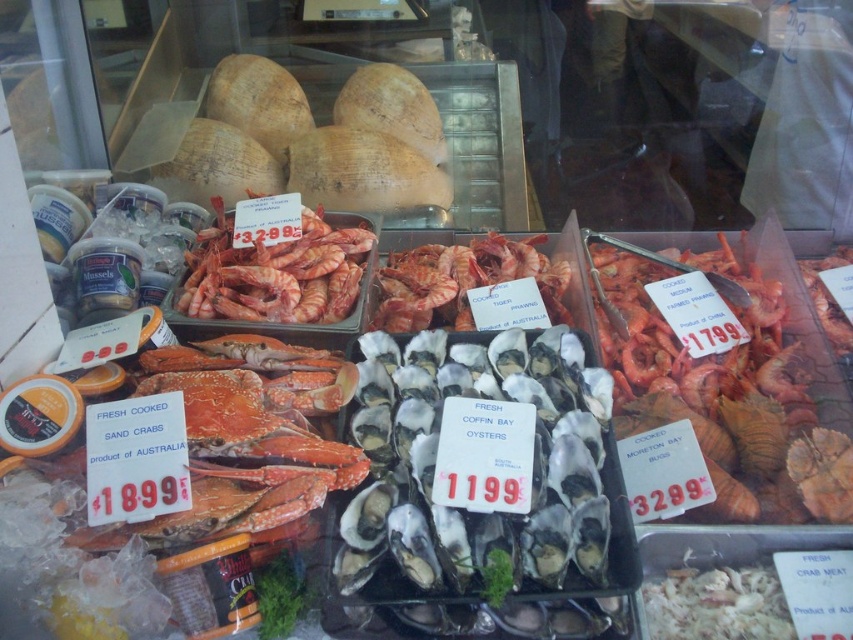
You are a customer at the seafood counter and want to buy both the white shell oysters at center and the red matte tiger prawns at center. The store has a promotion where if one item is wider than the other, you get a discount on the wider one. Which item would qualify for the discount?

The red matte tiger prawns at center qualifies for the discount because it has a greater width than the white shell oysters at center.

You are a customer at the seafood market and want to buy both the white shell oysters at center and the cooked sand crabs next to them. The store has a rule that items must be within 36 inches of each other to qualify for a discount. Can you get the discount?

The white shell oysters at center are 36.12 inches apart from the cooked sand crabs. Since 36.12 inches is slightly over the 36 inches requirement, you cannot qualify for the discount.

You are a customer looking at the seafood display case. You want to buy the shiny pink prawns at center and the red matte tiger prawns at center. If you start from the left side of the display, which prawn type should you look for first?

The shiny pink prawns at center is to the left of red matte tiger prawns at center, so you should look for the shiny pink prawns at center first when starting from the left side of the display.